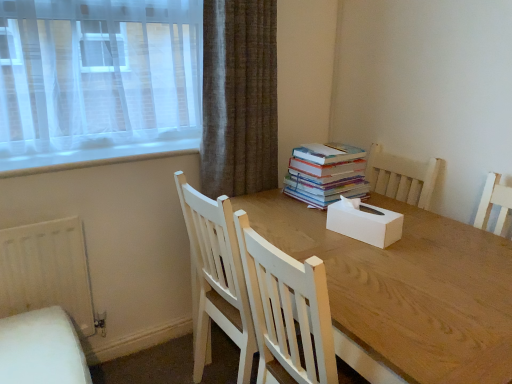
Where is `vacant area situated to the left side of multicolored paper book at center`? vacant area situated to the left side of multicolored paper book at center is located at coordinates (267, 199).